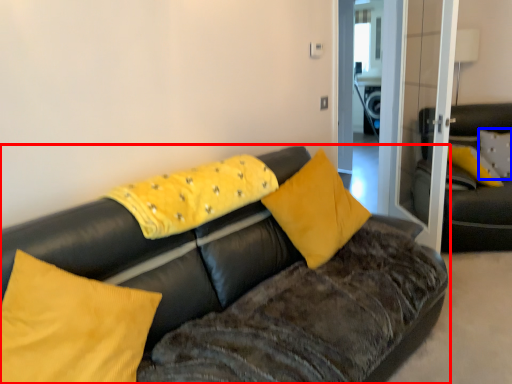
Question: Which object is further to the camera taking this photo, studio couch (highlighted by a red box) or pillow (highlighted by a blue box)?

Choices:
 (A) studio couch
 (B) pillow

Answer: (B)